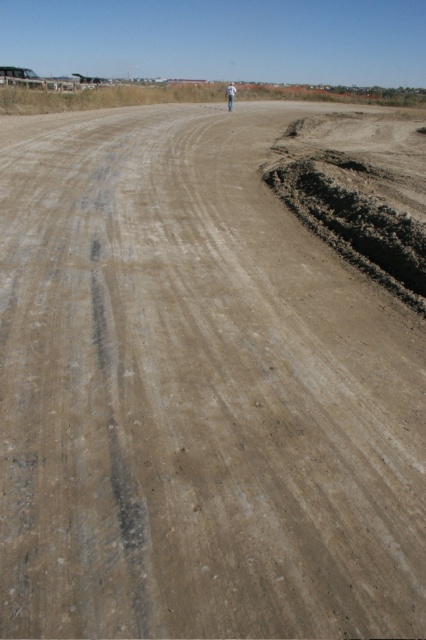
Question: Which object is closer to the camera taking this photo?

Choices:
 (A) light brown skin at center
 (B) dark brown clay at right

Answer: (B)

Question: Can you confirm if dark brown clay at right is positioned above light brown skin at center?

Choices:
 (A) yes
 (B) no

Answer: (B)

Question: Can you confirm if dark brown clay at right is bigger than light brown skin at center?

Choices:
 (A) yes
 (B) no

Answer: (A)

Question: Considering the relative positions of dark brown clay at right and light brown skin at center in the image provided, where is dark brown clay at right located with respect to light brown skin at center?

Choices:
 (A) above
 (B) below

Answer: (B)